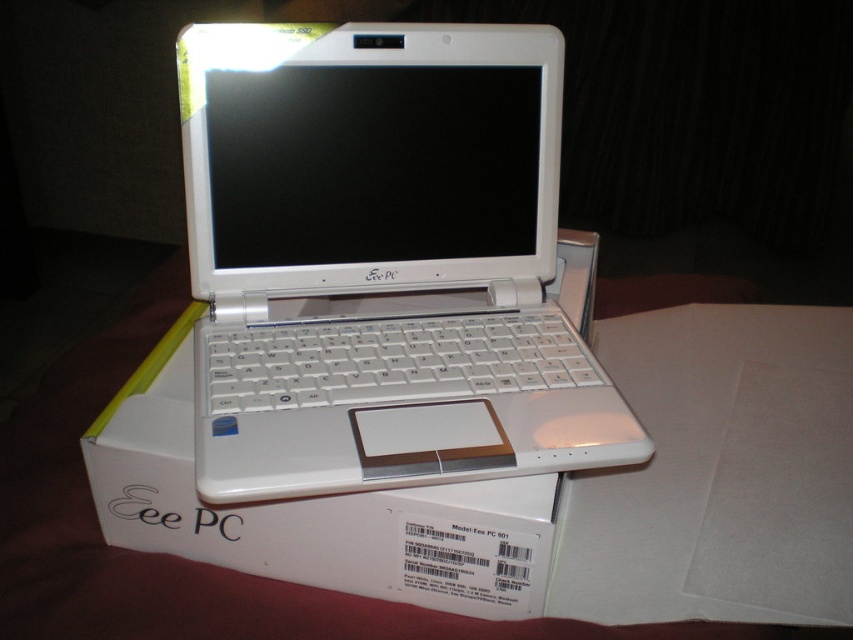
You are trying to locate the white glossy laptop at center in the image. What are its coordinates?

The white glossy laptop at center is located at coordinates point (381, 260).

You are setting up a new Eee PC laptop and need to place it on its packaging box. Based on the image, is the white glossy laptop at center already placed on top of the white cardboard box at center?

Yes, the white glossy laptop at center is positioned over white cardboard box at center, so it is already placed on top of it.

You are setting up a new Eee PC laptop and need to place it back into its packaging box. Based on the image, will the white glossy laptop at center fit into the white cardboard box at center?

The white glossy laptop at center has a larger size compared to white cardboard box at center, so it will not fit inside the box.